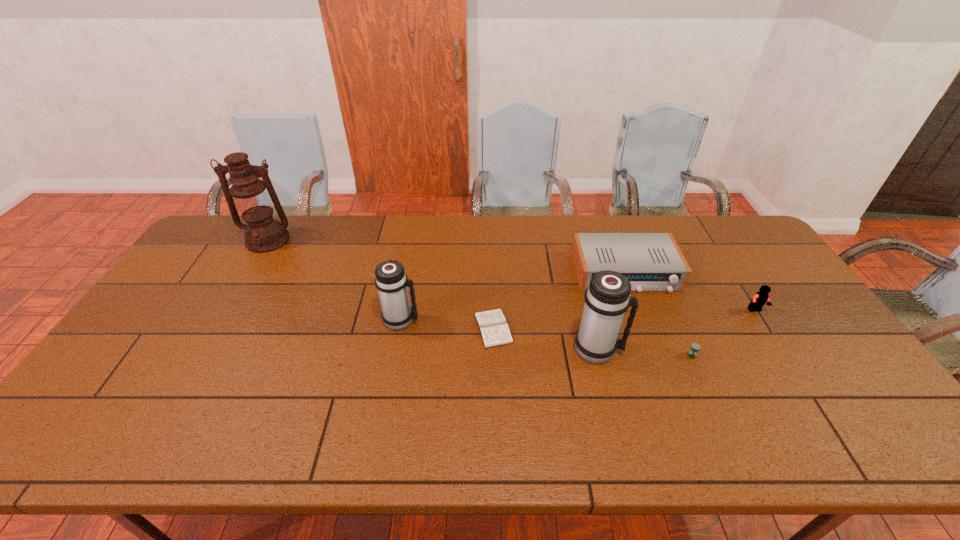
Identify the location of object present at the left edge. Image resolution: width=960 pixels, height=540 pixels. (248, 195).

Locate an element on the screen. The image size is (960, 540). object that is at the right edge is located at coordinates (760, 298).

You are a GUI agent. You are given a task and a screenshot of the screen. Output one action in this format:
    pyautogui.click(x=<x>, y=<y>)
    Task: Click on the object located at the far left corner
    The height and width of the screenshot is (540, 960).
    Given the screenshot: What is the action you would take?
    pyautogui.click(x=248, y=195)

Image resolution: width=960 pixels, height=540 pixels. In order to click on free space at the far edge of the desktop in this screenshot , I will do `click(451, 242)`.

Where is `free space at the near edge`? The image size is (960, 540). free space at the near edge is located at coordinates (643, 402).

This screenshot has width=960, height=540. In the image, there is a desktop. Find the location of `vacant space at the left edge`. vacant space at the left edge is located at coordinates click(214, 257).

Identify the location of vacant region at the right edge. This screenshot has height=540, width=960. (804, 330).

In the image, there is a desktop. Identify the location of vacant space at the far left corner. (237, 231).

Locate an element on the screen. Image resolution: width=960 pixels, height=540 pixels. free space at the far right corner of the desktop is located at coordinates (724, 234).

Identify the location of empty space between the diary and the third shortest object. (560, 300).